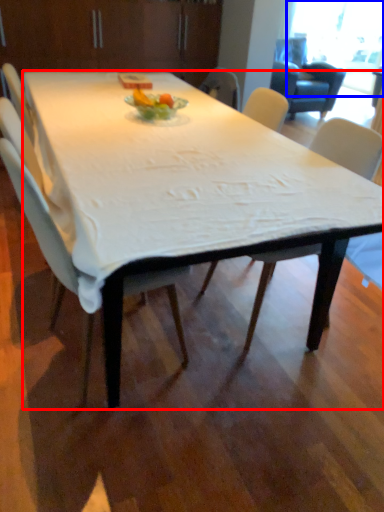
Question: Which of the following is the closest to the observer, desk (highlighted by a red box) or window screen (highlighted by a blue box)?

Choices:
 (A) desk
 (B) window screen

Answer: (A)